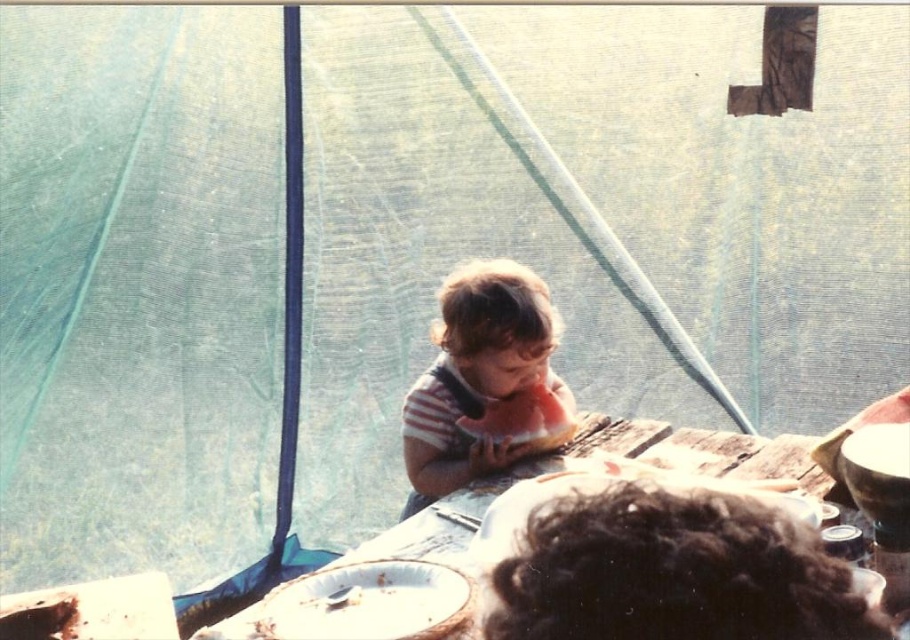
Question: Which point is closer to the camera?

Choices:
 (A) striped cotton shirt at center
 (B) wooden table at center

Answer: (B)

Question: Is striped cotton shirt at center bigger than wooden table at center?

Choices:
 (A) no
 (B) yes

Answer: (B)

Question: Is striped cotton shirt at center bigger than wooden table at center?

Choices:
 (A) yes
 (B) no

Answer: (A)

Question: Which object appears closest to the camera in this image?

Choices:
 (A) striped cotton shirt at center
 (B) wooden table at center
 (C) red matte watermelon at center

Answer: (B)

Question: Is striped cotton shirt at center smaller than wooden table at center?

Choices:
 (A) yes
 (B) no

Answer: (B)

Question: Which of these objects is positioned farthest from the wooden table at center?

Choices:
 (A) red matte watermelon at center
 (B) striped cotton shirt at center

Answer: (B)